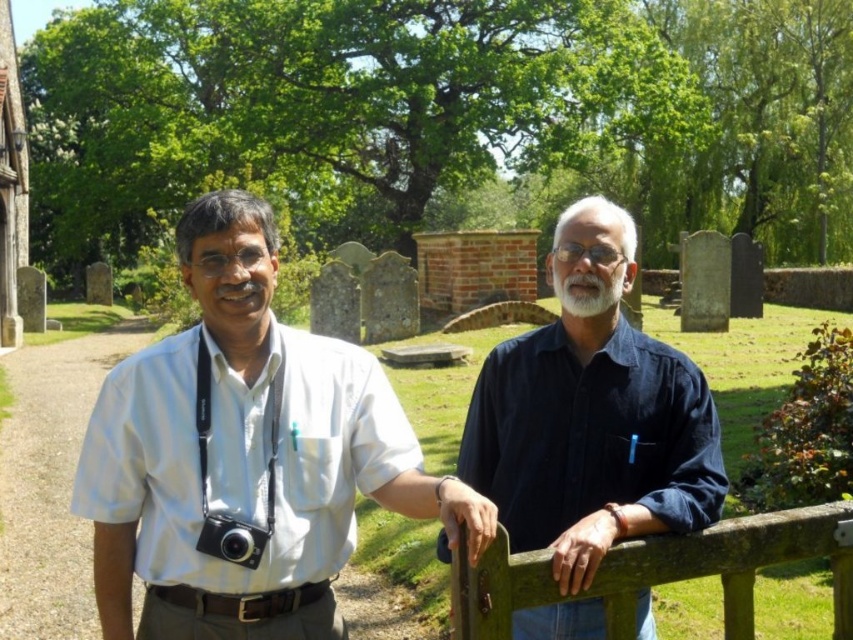
You are a photographer trying to decide where to place your new camera case. The case is designed to hold items smaller than the white soft beard at center. Can your black plastic camera at center fit into the case?

The black plastic camera at center is smaller than the white soft beard at center, so it can fit into the case designed for items smaller than the white soft beard at center.

You are a photographer positioned at the lower left corner of the scene. You need to take a photo of the dark blue shirt at center. Based on the coordinates provided in the Objects Description, in which direction should you move your camera to frame the subject properly?

The dark blue shirt at center is located at point coordinates, so you should move your camera towards the center of the scene to frame the subject properly.

You are a photographer trying to capture a portrait of the two people in the image. You want to ensure the white matte shirt at center and the white soft beard at center are both clearly visible. Which part should you focus on first to ensure proper depth of field?

The white matte shirt at center is positioned under the white soft beard at center, so focusing on the white soft beard at center first will ensure both are in focus due to their proximity in depth.